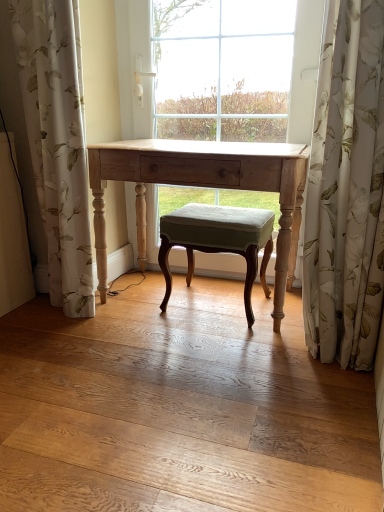
At what (x,y) coordinates should I click in order to perform the action: click on free space in front of light wood table at center. Please return your answer as a coordinate pair (x, y). Looking at the image, I should click on (194, 382).